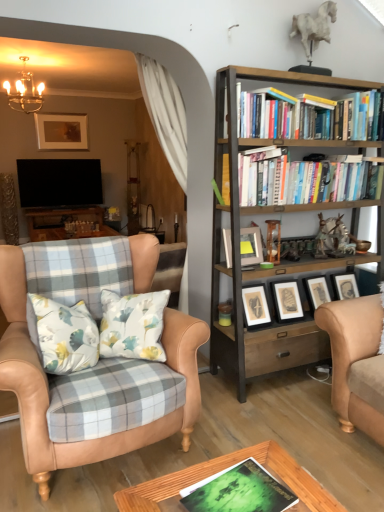
Question: Is tan leather chair at left not inside matte gray picture frame at center, which appears as the second picture frame when viewed from the left?

Choices:
 (A) no
 (B) yes

Answer: (B)

Question: Is tan leather chair at left taller than matte gray picture frame at center, which appears as the 1th picture frame when viewed from the front?

Choices:
 (A) no
 (B) yes

Answer: (B)

Question: Is the depth of tan leather chair at left greater than that of matte gray picture frame at center, which is the 1th picture frame in bottom-to-top order?

Choices:
 (A) no
 (B) yes

Answer: (A)

Question: Is the depth of tan leather chair at left less than that of matte gray picture frame at center, placed as the 2th picture frame when sorted from back to front?

Choices:
 (A) no
 (B) yes

Answer: (B)

Question: From the image's perspective, is tan leather chair at left over matte gray picture frame at center, the second picture frame in the top-to-bottom sequence?

Choices:
 (A) yes
 (B) no

Answer: (B)

Question: Is tan leather chair at left not near matte gray picture frame at center, which appears as the 1th picture frame when viewed from the front?

Choices:
 (A) yes
 (B) no

Answer: (B)

Question: Is metallic chandelier at upper left not within hardcover books at upper right, arranged as the second book when viewed from the front?

Choices:
 (A) no
 (B) yes

Answer: (B)

Question: Can you confirm if metallic chandelier at upper left is taller than hardcover books at upper right, acting as the 1th book starting from the back?

Choices:
 (A) no
 (B) yes

Answer: (B)

Question: Is metallic chandelier at upper left far away from hardcover books at upper right, arranged as the second book when viewed from the front?

Choices:
 (A) yes
 (B) no

Answer: (A)

Question: Does metallic chandelier at upper left have a larger size compared to hardcover books at upper right, arranged as the second book when viewed from the front?

Choices:
 (A) no
 (B) yes

Answer: (B)

Question: Is metallic chandelier at upper left wider than hardcover books at upper right, placed as the first book when sorted from right to left?

Choices:
 (A) no
 (B) yes

Answer: (B)

Question: From a real-world perspective, is metallic chandelier at upper left on hardcover books at upper right, placed as the first book when sorted from right to left?

Choices:
 (A) no
 (B) yes

Answer: (B)

Question: Is hardcover books at upper right, the second book in the left-to-right sequence, to the right of green matte book at center, the 2th book from the top, from the viewer's perspective?

Choices:
 (A) yes
 (B) no

Answer: (A)